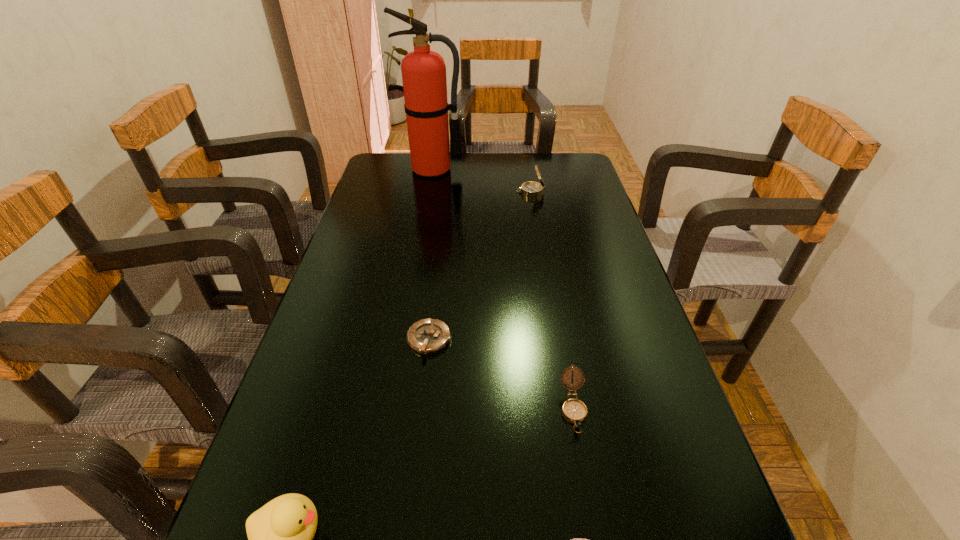
At what (x,y) coordinates should I click in order to perform the action: click on the tallest object. Please return your answer as a coordinate pair (x, y). Looking at the image, I should click on (423, 71).

Where is `fire extinguisher`? fire extinguisher is located at coordinates (423, 71).

The width and height of the screenshot is (960, 540). Identify the location of the second farthest object. (530, 189).

This screenshot has height=540, width=960. What are the coordinates of `the taller compass` in the screenshot? It's located at (530, 189).

Locate an element on the screen. Image resolution: width=960 pixels, height=540 pixels. the shorter compass is located at coordinates (574, 411).

At what (x,y) coordinates should I click in order to perform the action: click on the nearer compass. Please return your answer as a coordinate pair (x, y). This screenshot has width=960, height=540. Looking at the image, I should click on (574, 411).

In order to click on ashtray in this screenshot , I will do `click(428, 336)`.

Find the location of a particular element. The image size is (960, 540). the shortest object is located at coordinates (428, 336).

You are a GUI agent. You are given a task and a screenshot of the screen. Output one action in this format:
    pyautogui.click(x=<x>, y=<y>)
    Task: Click on the free space located 0.210m at the nozzle of the tallest object
    The width and height of the screenshot is (960, 540).
    Given the screenshot: What is the action you would take?
    pyautogui.click(x=426, y=212)

You are a GUI agent. You are given a task and a screenshot of the screen. Output one action in this format:
    pyautogui.click(x=<x>, y=<y>)
    Task: Click on the vacant space located with the dial facing the fifth nearest object
    The width and height of the screenshot is (960, 540).
    Given the screenshot: What is the action you would take?
    pyautogui.click(x=403, y=192)